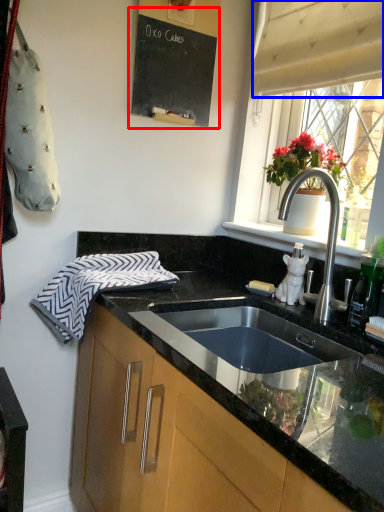
Question: Which object is further to the camera taking this photo, bulletin board (highlighted by a red box) or curtain (highlighted by a blue box)?

Choices:
 (A) bulletin board
 (B) curtain

Answer: (A)